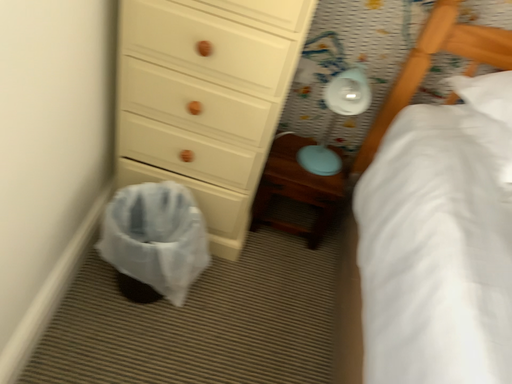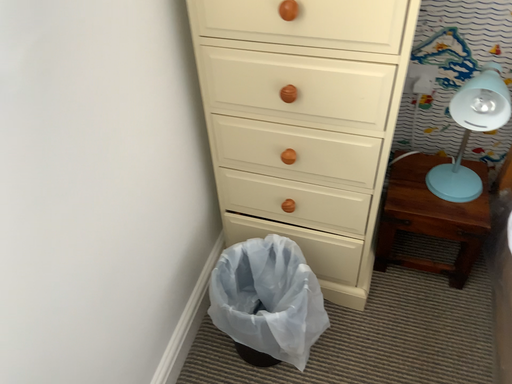
Question: Which way did the camera rotate in the video?

Choices:
 (A) rotated right
 (B) rotated left

Answer: (B)